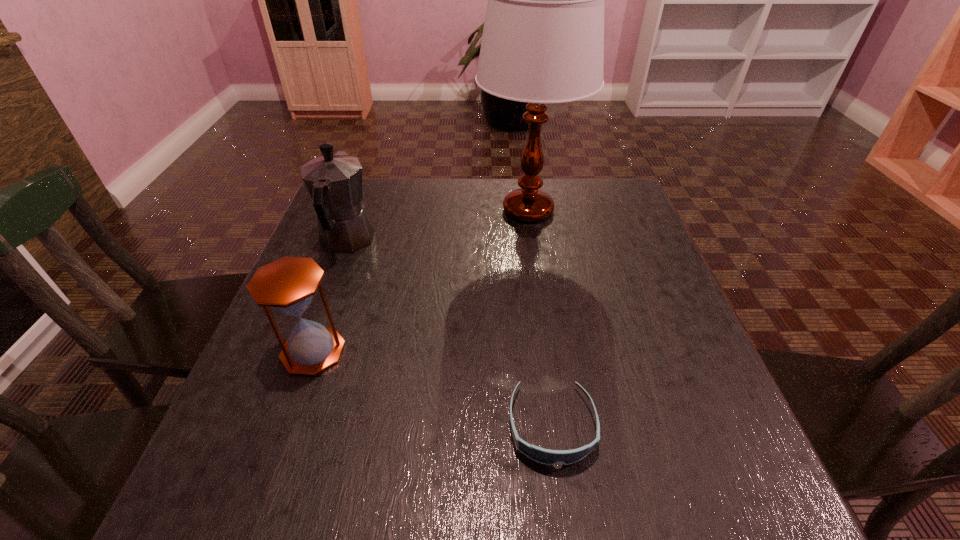
Find the location of a particular element. vacant space that satisfies the following two spatial constraints: 1. on the pouring side of the coffeepot; 2. on the right side of the table lamp is located at coordinates (358, 210).